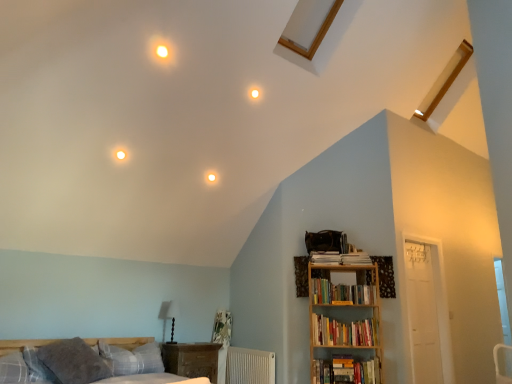
Question: Is white textured radiator at lower center at the right side of hardcover books at right, the 1th book from the bottom?

Choices:
 (A) yes
 (B) no

Answer: (B)

Question: Does white textured radiator at lower center have a greater width compared to hardcover books at right, the 1th book from the bottom?

Choices:
 (A) no
 (B) yes

Answer: (A)

Question: Does white textured radiator at lower center lie behind hardcover books at right, the third book viewed from the top?

Choices:
 (A) no
 (B) yes

Answer: (B)

Question: From a real-world perspective, is white textured radiator at lower center under hardcover books at right, the 1th book from the bottom?

Choices:
 (A) yes
 (B) no

Answer: (A)

Question: Is white textured radiator at lower center shorter than hardcover books at right, the third book viewed from the top?

Choices:
 (A) yes
 (B) no

Answer: (B)

Question: Is white textured radiator at lower center bigger than hardcover books at right, the third book viewed from the top?

Choices:
 (A) no
 (B) yes

Answer: (B)

Question: Is wooden bookshelf at right oriented away from hardcover books at upper right, the first book viewed from the top?

Choices:
 (A) yes
 (B) no

Answer: (A)

Question: Is the depth of wooden bookshelf at right less than that of hardcover books at upper right, the first book viewed from the top?

Choices:
 (A) no
 (B) yes

Answer: (B)

Question: From a real-world perspective, is wooden bookshelf at right on top of hardcover books at upper right, which is the third book from bottom to top?

Choices:
 (A) no
 (B) yes

Answer: (A)

Question: Are wooden bookshelf at right and hardcover books at upper right, which is the third book from bottom to top, located far from each other?

Choices:
 (A) no
 (B) yes

Answer: (A)

Question: Are wooden bookshelf at right and hardcover books at upper right, the first book viewed from the top, making contact?

Choices:
 (A) yes
 (B) no

Answer: (B)

Question: Is wooden bookshelf at right wider than hardcover books at upper right, which is the third book from bottom to top?

Choices:
 (A) no
 (B) yes

Answer: (B)

Question: Is white textured radiator at lower center behind plaid fabric pillow at lower left, the second pillow viewed from the right?

Choices:
 (A) no
 (B) yes

Answer: (B)